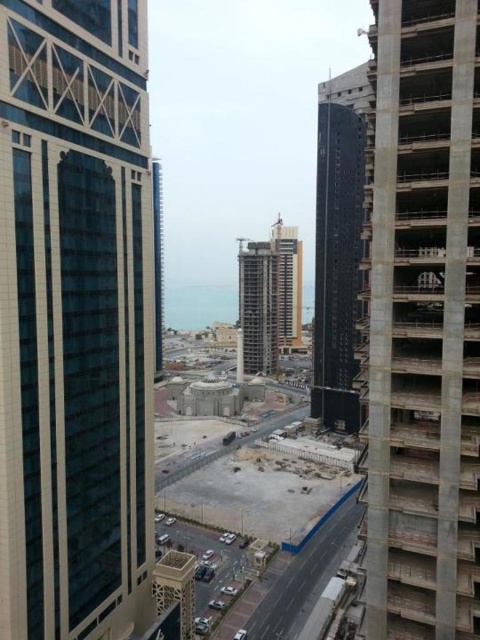
Question: Which of the following is the farthest from the observer?

Choices:
 (A) glassy concrete skyscraper at center
 (B) glassy blue skyscraper at left

Answer: (A)

Question: Among these points, which one is farthest from the camera?

Choices:
 (A) (83, 408)
 (B) (319, 96)
 (C) (396, 33)
 (D) (268, 243)

Answer: (D)

Question: Is concrete at right further to camera compared to glassy concrete skyscraper at center?

Choices:
 (A) yes
 (B) no

Answer: (B)

Question: Can you confirm if white concrete construction site at center is smaller than concrete construction at center?

Choices:
 (A) no
 (B) yes

Answer: (A)

Question: Based on their relative distances, which object is nearer to the white concrete construction site at center?

Choices:
 (A) glassy concrete skyscraper at center
 (B) concrete at right
 (C) glassy blue skyscraper at left
 (D) black glass tower at center

Answer: (D)

Question: Can you confirm if white concrete construction site at center is positioned to the right of glassy concrete skyscraper at center?

Choices:
 (A) no
 (B) yes

Answer: (A)